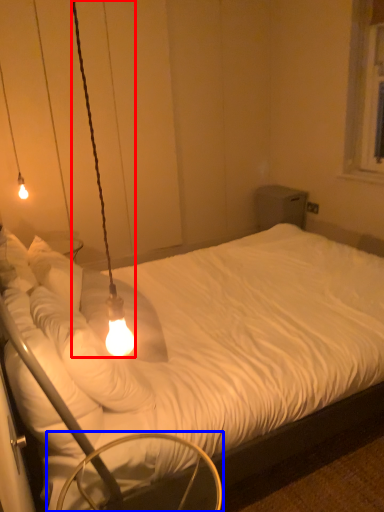
Question: Which of the following is the farthest to the observer, lamp (highlighted by a red box) or swivel chair (highlighted by a blue box)?

Choices:
 (A) lamp
 (B) swivel chair

Answer: (B)